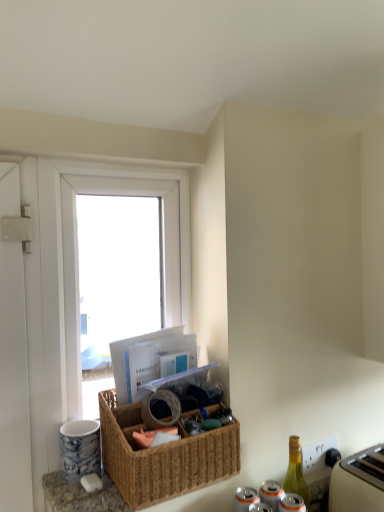
Describe the element at coordinates (358, 481) in the screenshot. I see `white plastic toaster at lower right` at that location.

What do you see at coordinates (162, 248) in the screenshot?
I see `white plastic window at upper left` at bounding box center [162, 248].

The image size is (384, 512). What do you see at coordinates (162, 456) in the screenshot?
I see `woven brown picnic basket at center` at bounding box center [162, 456].

At what (x,y) coordinates should I click in order to perform the action: click on white plastic toaster at lower right. Please return your answer as a coordinate pair (x, y). This screenshot has width=384, height=512. Looking at the image, I should click on (358, 481).

Considering the positions of objects green glass bottle at lower right and white plastic toaster at lower right in the image provided, who is in front, green glass bottle at lower right or white plastic toaster at lower right?

Positioned in front is white plastic toaster at lower right.

Could white plastic toaster at lower right be considered to be inside green glass bottle at lower right?

Actually, white plastic toaster at lower right is outside green glass bottle at lower right.

Visually, is green glass bottle at lower right positioned to the left or to the right of white plastic toaster at lower right?

green glass bottle at lower right is to the left of white plastic toaster at lower right.

Looking at their sizes, would you say green glass bottle at lower right is wider or thinner than woven brown picnic basket at center?

Considering their sizes, green glass bottle at lower right looks slimmer than woven brown picnic basket at center.

Can you confirm if green glass bottle at lower right is positioned to the right of woven brown picnic basket at center?

Yes, green glass bottle at lower right is to the right of woven brown picnic basket at center.

Can you tell me how much green glass bottle at lower right and woven brown picnic basket at center differ in facing direction?

green glass bottle at lower right and woven brown picnic basket at center are facing 1.55 degrees away from each other.

Do you think green glass bottle at lower right is within woven brown picnic basket at center, or outside of it?

green glass bottle at lower right lies outside woven brown picnic basket at center.

Considering the points (300, 494) and (62, 195), which point is behind, point (300, 494) or point (62, 195)?

The point (300, 494) is more distant.

The width and height of the screenshot is (384, 512). What are the coordinates of `bottle below the white plastic window at upper left (from a real-world perspective)` in the screenshot? It's located at (296, 472).

Looking at this image, from the image's perspective, relative to white plastic window at upper left, is green glass bottle at lower right above or below?

From the image's perspective, green glass bottle at lower right appears below white plastic window at upper left.

From a real-world perspective, between green glass bottle at lower right and white plastic window at upper left, who is vertically lower?

green glass bottle at lower right, from a real-world perspective.

Between white plastic window at upper left and woven brown picnic basket at center, which one has larger width?

woven brown picnic basket at center.

Can you confirm if white plastic window at upper left is taller than woven brown picnic basket at center?

Correct, white plastic window at upper left is much taller as woven brown picnic basket at center.

From the image's perspective, would you say white plastic window at upper left is positioned over woven brown picnic basket at center?

Indeed, from the image's perspective, white plastic window at upper left is shown above woven brown picnic basket at center.

Is woven brown picnic basket at center at the back of white plastic window at upper left?

No, woven brown picnic basket at center is not at the back of white plastic window at upper left.

Could you tell me if white plastic window at upper left is facing green glass bottle at lower right?

No, white plastic window at upper left is not facing towards green glass bottle at lower right.

Where is `window behind the green glass bottle at lower right`? window behind the green glass bottle at lower right is located at coordinates (162, 248).

From a real-world perspective, who is located lower, white plastic window at upper left or green glass bottle at lower right?

green glass bottle at lower right is physically lower.

Considering the sizes of objects white plastic window at upper left and green glass bottle at lower right in the image provided, who is smaller, white plastic window at upper left or green glass bottle at lower right?

With smaller size is green glass bottle at lower right.

Between white plastic toaster at lower right and white plastic window at upper left, which one has larger size?

With larger size is white plastic window at upper left.

Which is behind, point (366, 482) or point (111, 181)?

Point (111, 181)

Is white plastic toaster at lower right turned away from white plastic window at upper left?

No, white plastic window at upper left is not at the back of white plastic toaster at lower right.

Considering the relative positions of white plastic toaster at lower right and white plastic window at upper left in the image provided, is white plastic toaster at lower right to the right of white plastic window at upper left from the viewer's perspective?

Yes, white plastic toaster at lower right is to the right of white plastic window at upper left.

Is white plastic toaster at lower right behind green glass bottle at lower right?

No, white plastic toaster at lower right is closer to the viewer.

From a real-world perspective, is white plastic toaster at lower right located beneath green glass bottle at lower right?

Yes, from a real-world perspective, white plastic toaster at lower right is beneath green glass bottle at lower right.

Does white plastic toaster at lower right have a lesser width compared to green glass bottle at lower right?

No.

Who is bigger, white plastic toaster at lower right or green glass bottle at lower right?

Bigger between the two is white plastic toaster at lower right.

At what (x,y) coordinates should I click in order to perform the action: click on bottle on the left of white plastic toaster at lower right. Please return your answer as a coordinate pair (x, y). The image size is (384, 512). Looking at the image, I should click on (296, 472).

Locate an element on the screen. The height and width of the screenshot is (512, 384). picnic basket above the green glass bottle at lower right (from a real-world perspective) is located at coordinates (162, 456).

Considering their positions, is green glass bottle at lower right positioned closer to woven brown picnic basket at center than white plastic window at upper left?

white plastic window at upper left is closer to woven brown picnic basket at center.

Looking at the image, which one is located closer to green glass bottle at lower right, woven brown picnic basket at center or white plastic toaster at lower right?

The object closer to green glass bottle at lower right is white plastic toaster at lower right.

Based on their spatial positions, is green glass bottle at lower right or white plastic window at upper left closer to white plastic toaster at lower right?

green glass bottle at lower right is closer to white plastic toaster at lower right.

Based on their spatial positions, is white plastic toaster at lower right or white plastic window at upper left closer to woven brown picnic basket at center?

The object closer to woven brown picnic basket at center is white plastic window at upper left.

Which object lies further to the anchor point green glass bottle at lower right, woven brown picnic basket at center or white plastic window at upper left?

Based on the image, white plastic window at upper left appears to be further to green glass bottle at lower right.

Estimate the real-world distances between objects in this image. Which object is closer to white plastic toaster at lower right, white plastic window at upper left or woven brown picnic basket at center?

The object closer to white plastic toaster at lower right is woven brown picnic basket at center.

Which object lies nearer to the anchor point white plastic toaster at lower right, woven brown picnic basket at center or white plastic window at upper left?

The object closer to white plastic toaster at lower right is woven brown picnic basket at center.

When comparing their distances from green glass bottle at lower right, does white plastic toaster at lower right or white plastic window at upper left seem closer?

white plastic toaster at lower right is positioned closer to the anchor green glass bottle at lower right.

In order to click on bottle between woven brown picnic basket at center and white plastic toaster at lower right in this screenshot , I will do `click(296, 472)`.

The height and width of the screenshot is (512, 384). Find the location of `picnic basket between white plastic window at upper left and green glass bottle at lower right in the vertical direction`. picnic basket between white plastic window at upper left and green glass bottle at lower right in the vertical direction is located at coordinates (162, 456).

Where is `bottle between white plastic window at upper left and white plastic toaster at lower right in the horizontal direction`? The width and height of the screenshot is (384, 512). bottle between white plastic window at upper left and white plastic toaster at lower right in the horizontal direction is located at coordinates (296, 472).

Image resolution: width=384 pixels, height=512 pixels. In order to click on picnic basket between white plastic window at upper left and white plastic toaster at lower right from left to right in this screenshot , I will do `click(162, 456)`.